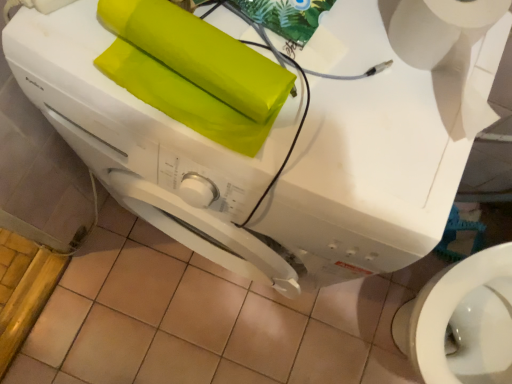
Identify the location of free space to the left of white matte toilet paper at upper right. (327, 48).